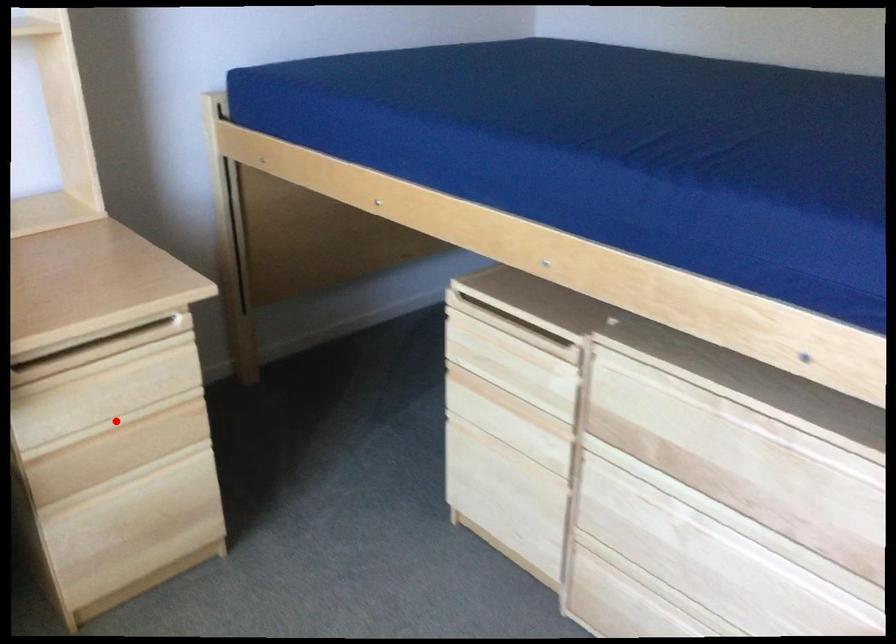
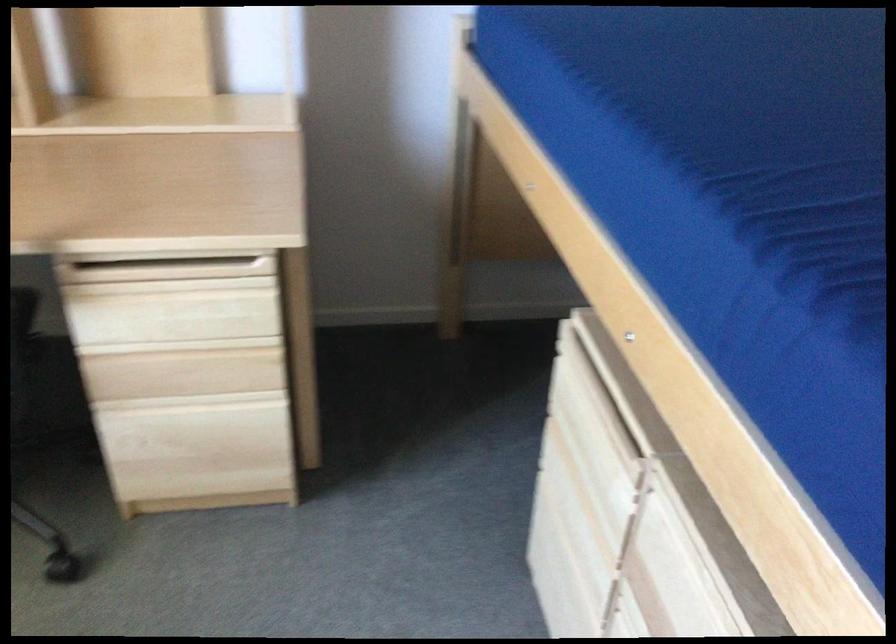
Locate, in the second image, the point that corresponds to the highlighted location in the first image.

(179, 346)